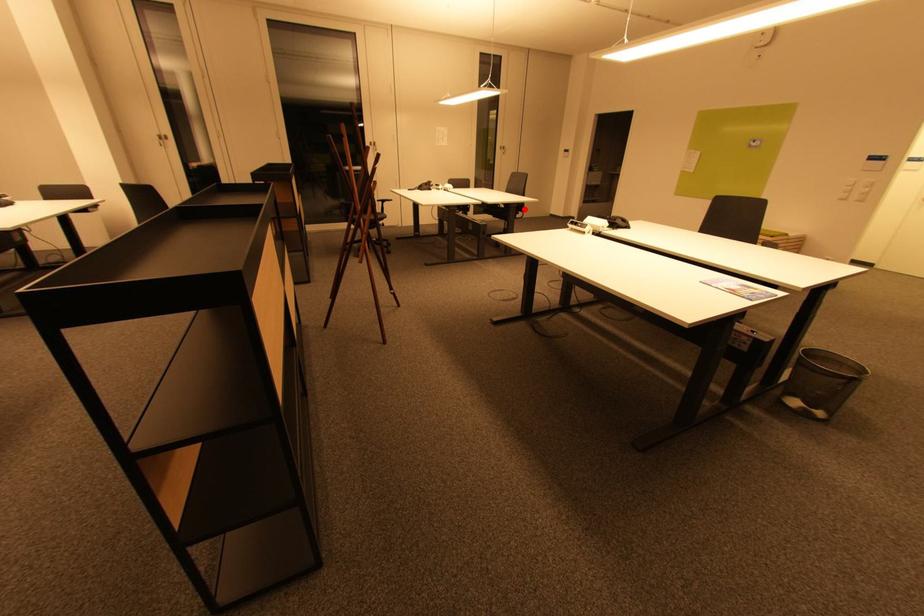
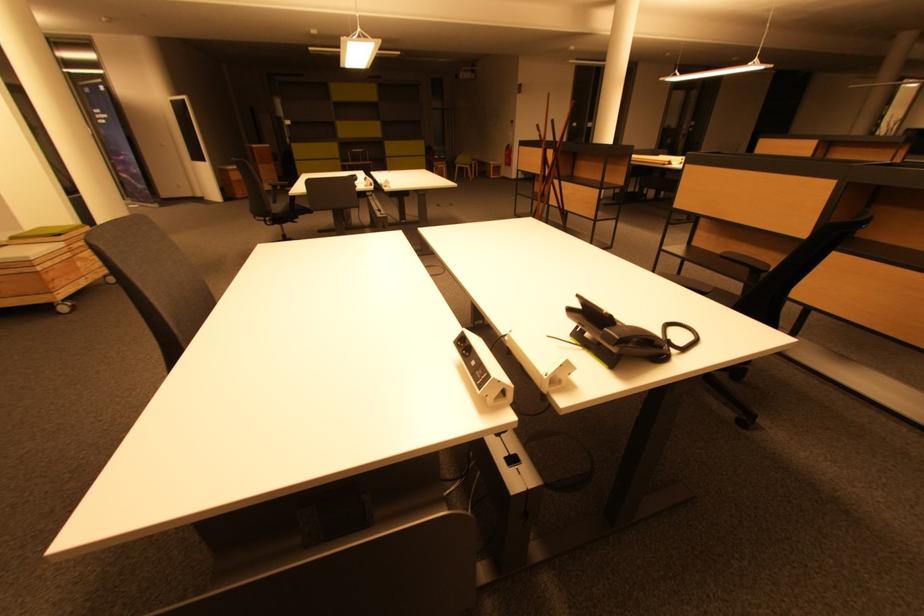
Question: I am providing you with two images of the same scene from different viewpoints. A red point is marked on the first image. At the location where the point appears in image 1, is it still visible in image 2?

Choices:
 (A) Yes
 (B) No

Answer: (B)